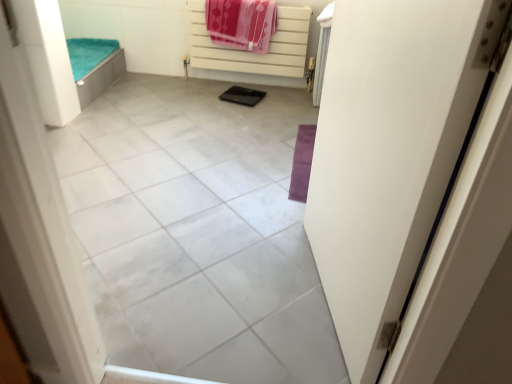
You are a GUI agent. You are given a task and a screenshot of the screen. Output one action in this format:
    pyautogui.click(x=<x>, y=<y>)
    Task: Click on the vacant location below white matte radiator at upper center (from a real-world perspective)
    
    Given the screenshot: What is the action you would take?
    pyautogui.click(x=261, y=79)